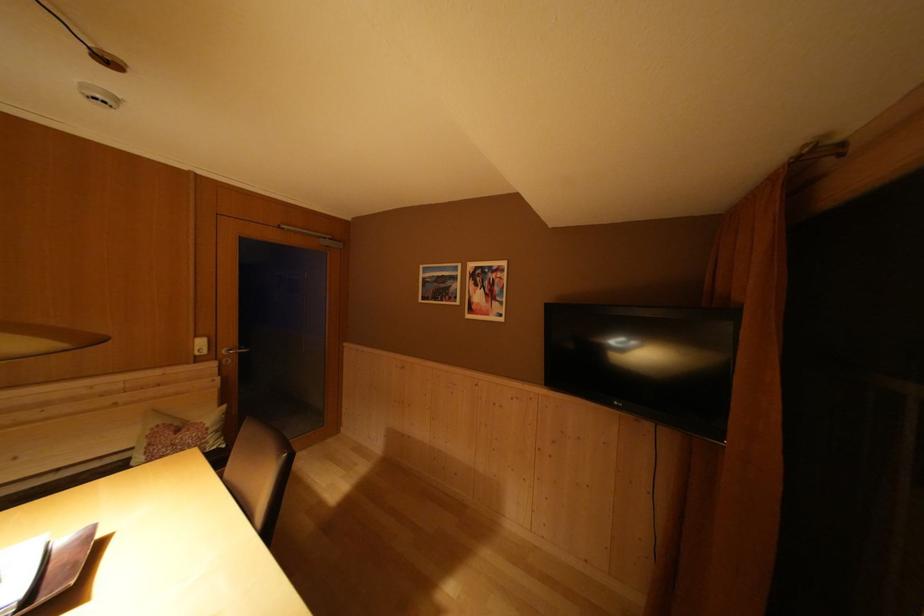
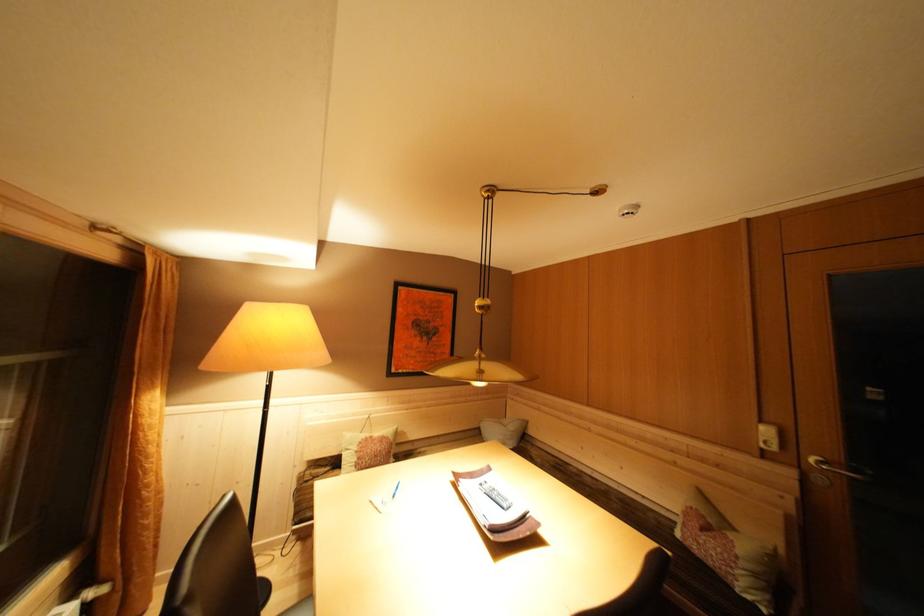
Find the pixel in the second image that matches [214,430] in the first image.

(746, 557)